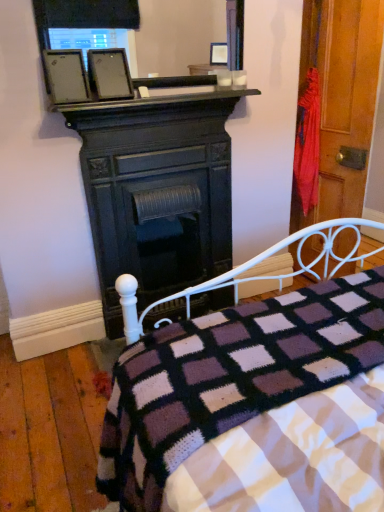
You are a GUI agent. You are given a task and a screenshot of the screen. Output one action in this format:
    pyautogui.click(x=<x>, y=<y>)
    Task: Click on the vacant area on top of matte black fireplace at center (from a real-world perspective)
    The height and width of the screenshot is (512, 384).
    Given the screenshot: What is the action you would take?
    pyautogui.click(x=178, y=101)